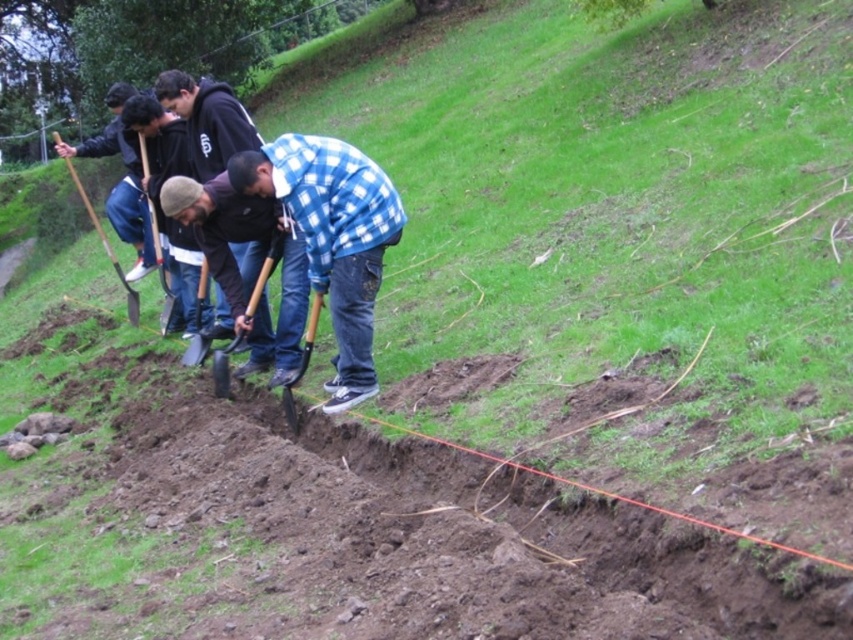
Question: Considering the relative positions of brushed metal shovel at center and shiny metallic shovel at center in the image provided, where is brushed metal shovel at center located with respect to shiny metallic shovel at center?

Choices:
 (A) left
 (B) right

Answer: (A)

Question: Based on their relative distances, which object is farther from the wooden shovel at left?

Choices:
 (A) shiny metallic shovel at center
 (B) blue checkered shirt at center

Answer: (B)

Question: Does metallic silver shovel at center have a greater width compared to wooden shovel at center?

Choices:
 (A) no
 (B) yes

Answer: (A)

Question: Which point is closer to the camera?

Choices:
 (A) (195, 364)
 (B) (254, 307)
 (C) (320, 298)
 (D) (167, 314)

Answer: (C)

Question: Estimate the real-world distances between objects in this image. Which object is farther from the wooden shovel at center?

Choices:
 (A) blue checkered shirt at center
 (B) metallic silver shovel at center

Answer: (A)

Question: Can you confirm if wooden shovel at center is positioned below brushed metal shovel at center?

Choices:
 (A) yes
 (B) no

Answer: (A)